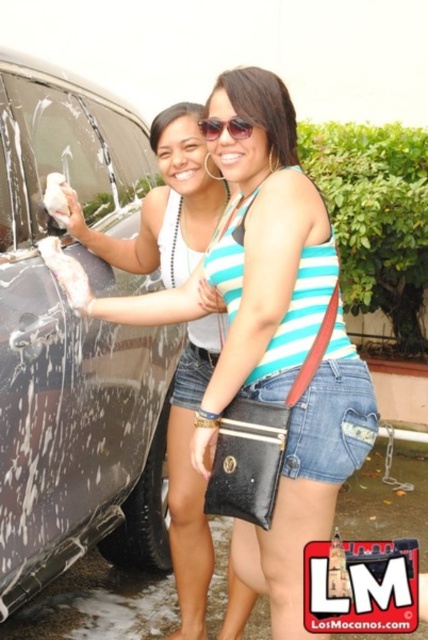
Question: Which object appears farthest from the camera in this image?

Choices:
 (A) shiny metallic car at left
 (B) sunglasses at upper center

Answer: (B)

Question: Is the position of blue striped tank top at center more distant than that of sunglasses at upper center?

Choices:
 (A) yes
 (B) no

Answer: (B)

Question: Is shiny metallic car at left positioned before sunglasses at upper center?

Choices:
 (A) no
 (B) yes

Answer: (B)

Question: Is blue striped tank top at center further to the viewer compared to sunglasses at upper center?

Choices:
 (A) no
 (B) yes

Answer: (A)

Question: Estimate the real-world distances between objects in this image. Which object is closer to the shiny metallic car at left?

Choices:
 (A) blue striped tank top at center
 (B) sunglasses at upper center

Answer: (A)

Question: Among these points, which one is farthest from the camera?

Choices:
 (A) 143,477
 (B) 223,125
 (C) 329,483

Answer: (A)